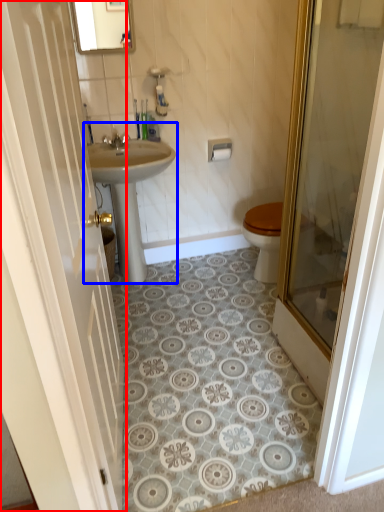
Question: Which of the following is the farthest to the observer, door (highlighted by a red box) or sink (highlighted by a blue box)?

Choices:
 (A) door
 (B) sink

Answer: (B)